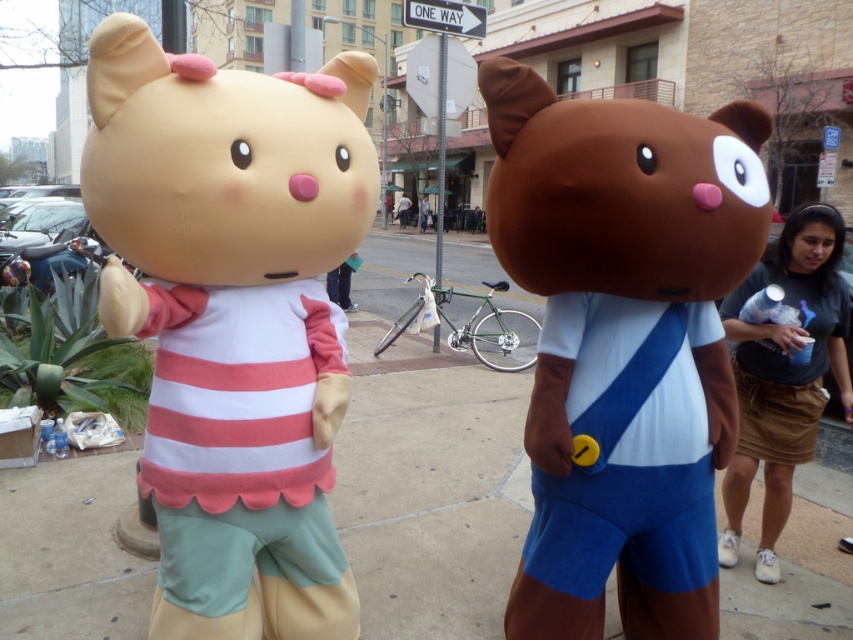
Question: Is matte pink plush teddy bear at left closer to the viewer compared to matte plastic phone at center?

Choices:
 (A) yes
 (B) no

Answer: (A)

Question: Does matte pink plush teddy bear at left appear over matte brown teddy bear at center?

Choices:
 (A) yes
 (B) no

Answer: (A)

Question: Which object is positioned farthest from the matte brown teddy bear at center?

Choices:
 (A) matte pink plush teddy bear at left
 (B) brown cotton skirt at lower right
 (C) light blue fabric umbrella at center
 (D) matte plastic phone at center

Answer: (C)

Question: Among these objects, which one is farthest from the camera?

Choices:
 (A) matte brown teddy bear at center
 (B) brown cotton skirt at lower right
 (C) matte plastic phone at center
 (D) matte pink plush teddy bear at left

Answer: (C)

Question: Does matte brown teddy bear at center appear over brown cotton skirt at lower right?

Choices:
 (A) yes
 (B) no

Answer: (A)

Question: Among these points, which one is farthest from the camera?

Choices:
 (A) (401, 200)
 (B) (351, 257)

Answer: (A)